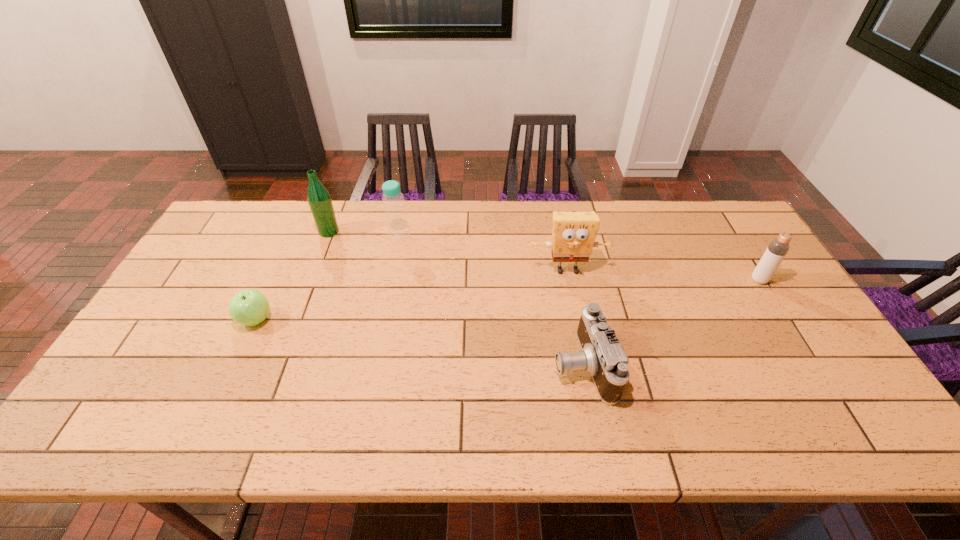
In the image, there is a desktop. Where is `free space at the far left corner`? The width and height of the screenshot is (960, 540). free space at the far left corner is located at coordinates (232, 210).

In the image, there is a desktop. Identify the location of vacant space at the near right corner. (862, 430).

Identify the location of free space between the fifth tallest object and the nearest bottle. Image resolution: width=960 pixels, height=540 pixels. (671, 322).

This screenshot has width=960, height=540. What are the coordinates of `free area in between the fifth tallest object and the shortest object` in the screenshot? It's located at (420, 342).

Where is `empty space that is in between the camera and the apple`? This screenshot has height=540, width=960. empty space that is in between the camera and the apple is located at coordinates (420, 342).

The width and height of the screenshot is (960, 540). Identify the location of empty space that is in between the rightmost bottle and the apple. (507, 300).

The height and width of the screenshot is (540, 960). Find the location of `empty location between the second shortest object and the third object from left to right`. empty location between the second shortest object and the third object from left to right is located at coordinates (491, 300).

You are a GUI agent. You are given a task and a screenshot of the screen. Output one action in this format:
    pyautogui.click(x=<x>, y=<y>)
    Task: Click on the unoccupied area between the rightmost object and the camera
    The height and width of the screenshot is (540, 960).
    Given the screenshot: What is the action you would take?
    pyautogui.click(x=671, y=322)

Image resolution: width=960 pixels, height=540 pixels. Identify the location of free space between the fifth object from right to left and the camera. (456, 298).

Where is `free space between the rightmost bottle and the camera`? The image size is (960, 540). free space between the rightmost bottle and the camera is located at coordinates (671, 322).